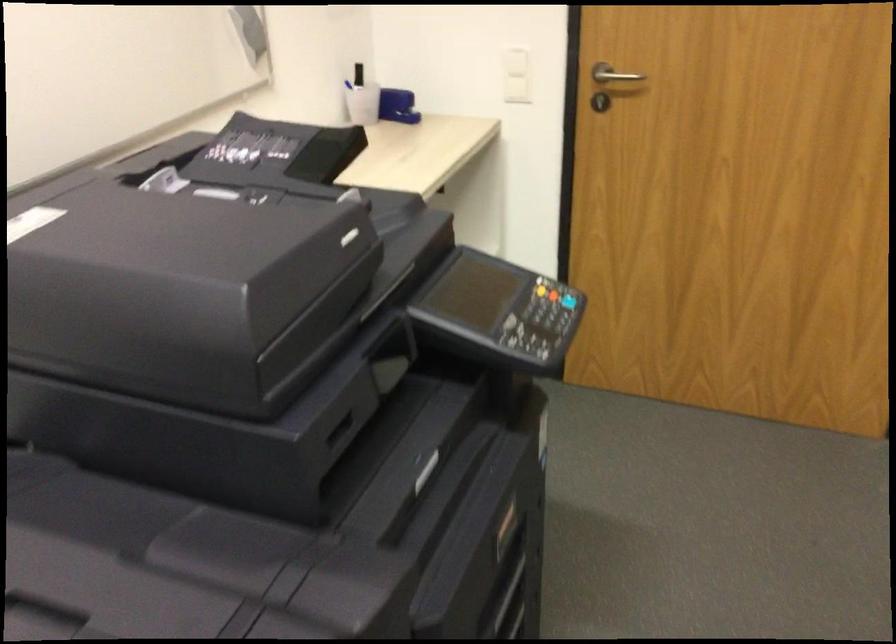
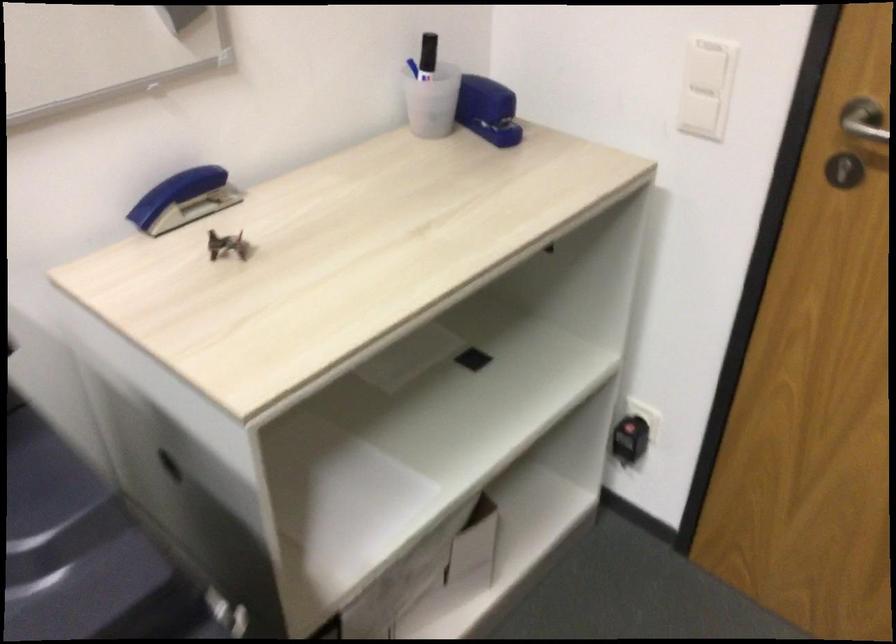
The point at (349, 82) is marked in the first image. Where is the corresponding point in the second image?

(412, 67)